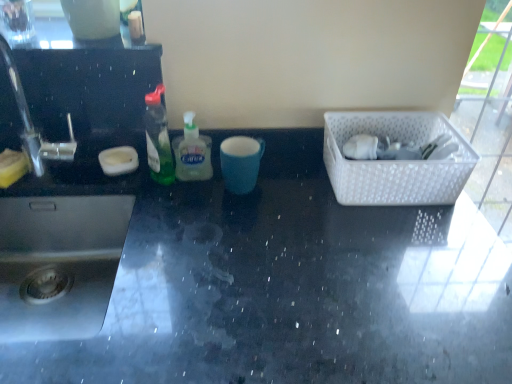
In order to click on vacant space in front of white plastic basket at right in this screenshot , I will do `click(402, 245)`.